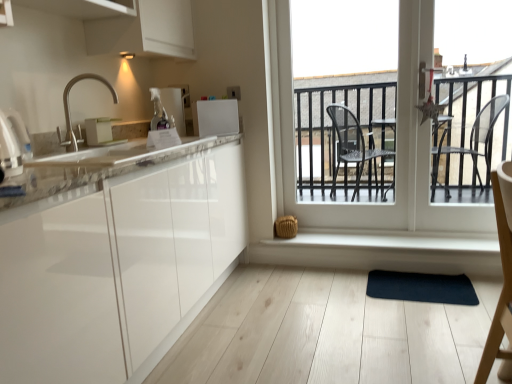
Where is `free location in front of dark blue rubber yoga mat at center`? The width and height of the screenshot is (512, 384). free location in front of dark blue rubber yoga mat at center is located at coordinates (426, 326).